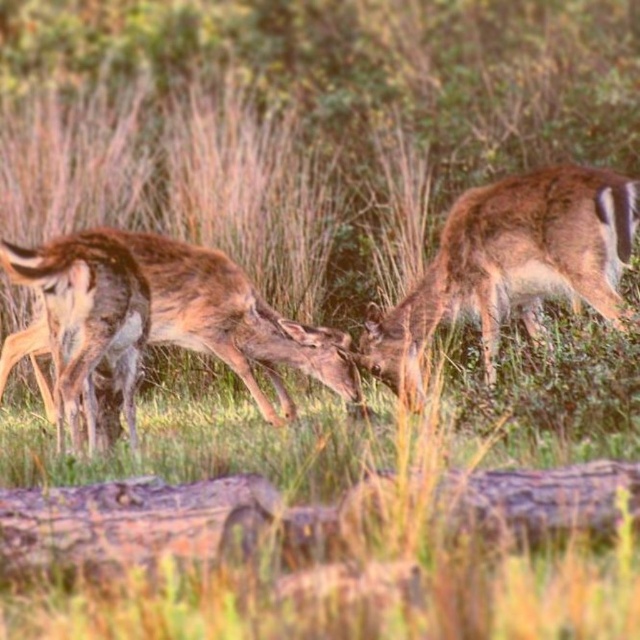
You are a wildlife photographer aiming to capture a photo of the brown furry deer at right and the brown fur deer at center in the same frame. Given that your camera has a maximum focus range of 3 feet, will you be able to include both deer in the shot?

The brown furry deer at right and brown fur deer at center are 3.76 feet apart from each other, which exceeds the camera maximum focus range of 3 feet. Therefore, it will be difficult to capture both deer in the same focused frame.